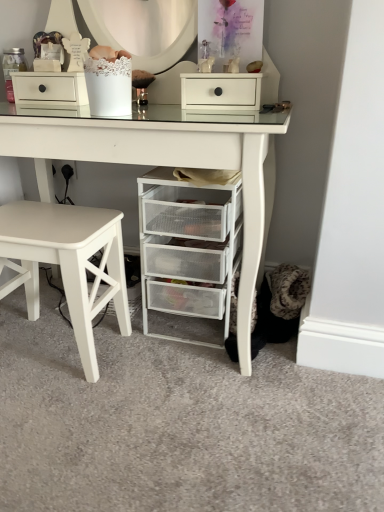
Question: Is white matte drawer at upper center bigger than white mesh drawer unit at lower center?

Choices:
 (A) yes
 (B) no

Answer: (B)

Question: Is white matte drawer at upper center oriented towards white mesh drawer unit at lower center?

Choices:
 (A) yes
 (B) no

Answer: (A)

Question: Considering the relative sizes of white matte drawer at upper center and white mesh drawer unit at lower center in the image provided, is white matte drawer at upper center thinner than white mesh drawer unit at lower center?

Choices:
 (A) no
 (B) yes

Answer: (B)

Question: Is white mesh drawer unit at lower center at the back of white matte drawer at upper center?

Choices:
 (A) yes
 (B) no

Answer: (A)

Question: From the image's perspective, is white matte drawer at upper center on white mesh drawer unit at lower center?

Choices:
 (A) no
 (B) yes

Answer: (B)

Question: From the image's perspective, is white matte drawer at upper center under white mesh drawer unit at lower center?

Choices:
 (A) no
 (B) yes

Answer: (A)

Question: Considering the relative sizes of white mesh drawer unit at lower center and white matte drawer at upper center in the image provided, is white mesh drawer unit at lower center smaller than white matte drawer at upper center?

Choices:
 (A) no
 (B) yes

Answer: (A)

Question: From a real-world perspective, is white mesh drawer unit at lower center physically above white matte drawer at upper center?

Choices:
 (A) no
 (B) yes

Answer: (A)

Question: Is white mesh drawer unit at lower center to the left of white matte drawer at upper center from the viewer's perspective?

Choices:
 (A) no
 (B) yes

Answer: (B)

Question: Are white mesh drawer unit at lower center and white matte drawer at upper center far apart?

Choices:
 (A) no
 (B) yes

Answer: (A)

Question: Is white mesh drawer unit at lower center not within white matte drawer at upper center?

Choices:
 (A) yes
 (B) no

Answer: (A)

Question: Is white mesh drawer unit at lower center bigger than white matte drawer at upper center?

Choices:
 (A) yes
 (B) no

Answer: (A)

Question: Are white mesh drawer unit at lower right and white mesh drawer unit at lower center beside each other?

Choices:
 (A) yes
 (B) no

Answer: (B)